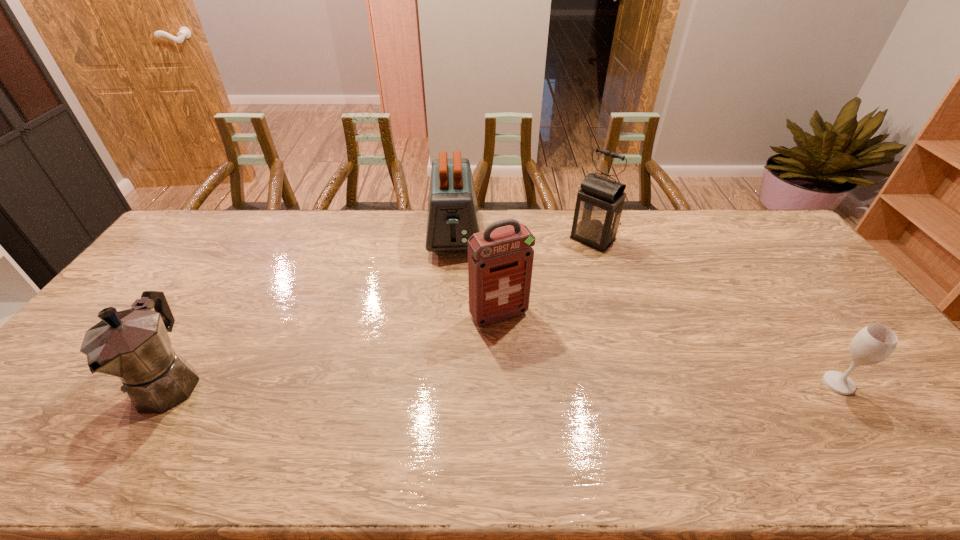
This screenshot has width=960, height=540. In order to click on free space on the desktop that is between the leftmost object and the wineglass and is positioned on the front-facing side of the first-aid kit in this screenshot , I will do `click(539, 383)`.

Find the location of `vacant space on the desktop that is between the leftmost object and the wineglass and is positioned on the front-facing side of the lantern`. vacant space on the desktop that is between the leftmost object and the wineglass and is positioned on the front-facing side of the lantern is located at coordinates (443, 383).

Identify the location of free spot on the desktop that is between the coffeepot and the rightmost object and is positioned on the front-facing side of the toaster. This screenshot has width=960, height=540. (457, 383).